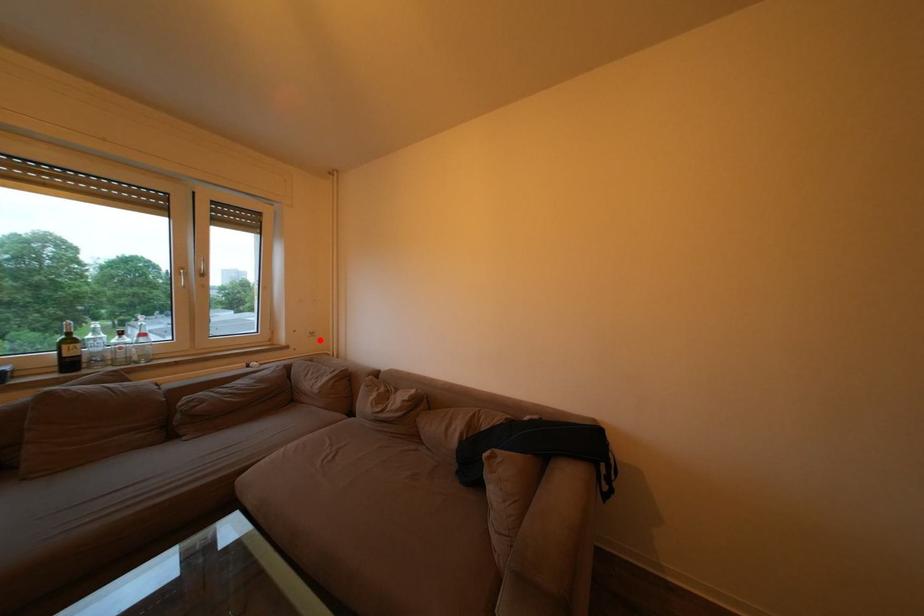
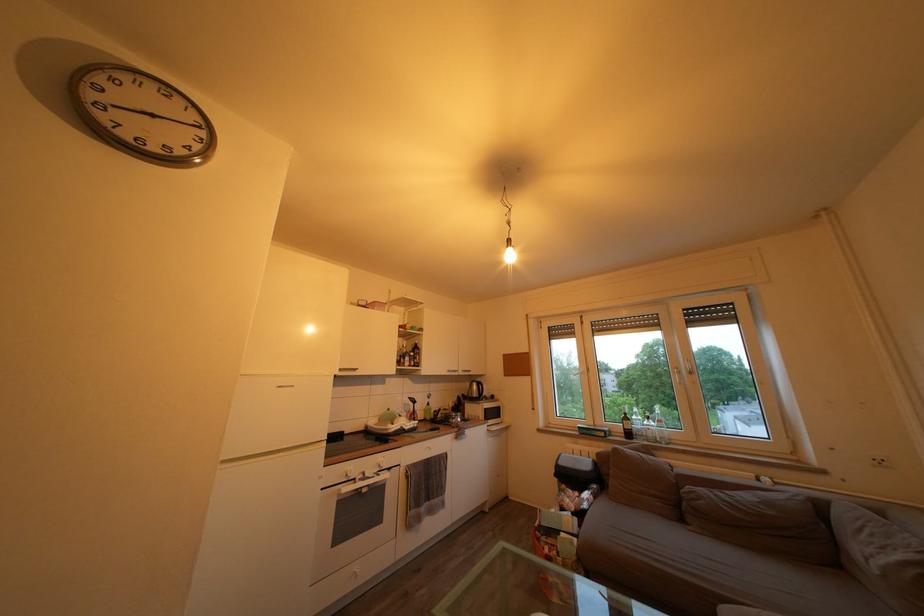
Question: I am providing you with two images of the same scene from different viewpoints. Image1 has a red point marked. In image2, the corresponding 3D location appears at what relative position? Reply with the corresponding letter.

Choices:
 (A) Closer
 (B) Farther

Answer: (A)